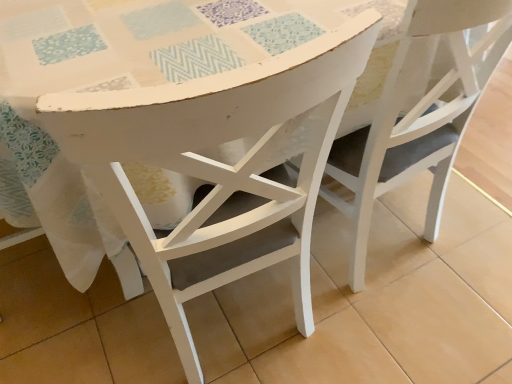
Question: Is white matte chair at center, arranged as the second chair when viewed from the right, a part of white matte chair at center, marked as the 2th chair in a left-to-right arrangement?

Choices:
 (A) no
 (B) yes

Answer: (A)

Question: Is white matte chair at center, marked as the 2th chair in a left-to-right arrangement, closer to camera compared to white matte chair at center, the first chair viewed from the left?

Choices:
 (A) no
 (B) yes

Answer: (A)

Question: From a real-world perspective, does white matte chair at center, acting as the first chair starting from the right, sit lower than white matte chair at center, arranged as the second chair when viewed from the right?

Choices:
 (A) yes
 (B) no

Answer: (A)

Question: From the image's perspective, does white matte chair at center, acting as the first chair starting from the right, appear higher than white matte chair at center, arranged as the second chair when viewed from the right?

Choices:
 (A) yes
 (B) no

Answer: (A)

Question: Is white matte chair at center, acting as the first chair starting from the right, turned away from white matte chair at center, the first chair viewed from the left?

Choices:
 (A) no
 (B) yes

Answer: (A)

Question: Can you see white matte chair at center, marked as the 2th chair in a left-to-right arrangement, touching white matte chair at center, arranged as the second chair when viewed from the right?

Choices:
 (A) yes
 (B) no

Answer: (B)

Question: Is white matte chair at center, the first chair viewed from the left, far away from white matte chair at center, acting as the first chair starting from the right?

Choices:
 (A) yes
 (B) no

Answer: (B)

Question: Does white matte chair at center, the first chair viewed from the left, have a greater width compared to white matte chair at center, marked as the 2th chair in a left-to-right arrangement?

Choices:
 (A) no
 (B) yes

Answer: (A)

Question: Is white matte chair at center, arranged as the second chair when viewed from the right, further to the viewer compared to white matte chair at center, acting as the first chair starting from the right?

Choices:
 (A) no
 (B) yes

Answer: (A)

Question: From a real-world perspective, is white matte chair at center, the first chair viewed from the left, on white matte chair at center, marked as the 2th chair in a left-to-right arrangement?

Choices:
 (A) no
 (B) yes

Answer: (B)

Question: From a real-world perspective, does white matte chair at center, the first chair viewed from the left, sit lower than white matte chair at center, marked as the 2th chair in a left-to-right arrangement?

Choices:
 (A) no
 (B) yes

Answer: (A)

Question: Does white matte chair at center, the first chair viewed from the left, appear on the left side of white matte chair at center, marked as the 2th chair in a left-to-right arrangement?

Choices:
 (A) no
 (B) yes

Answer: (B)

Question: Is white matte chair at center, arranged as the second chair when viewed from the right, spatially inside white matte chair at center, acting as the first chair starting from the right, or outside of it?

Choices:
 (A) inside
 (B) outside

Answer: (B)